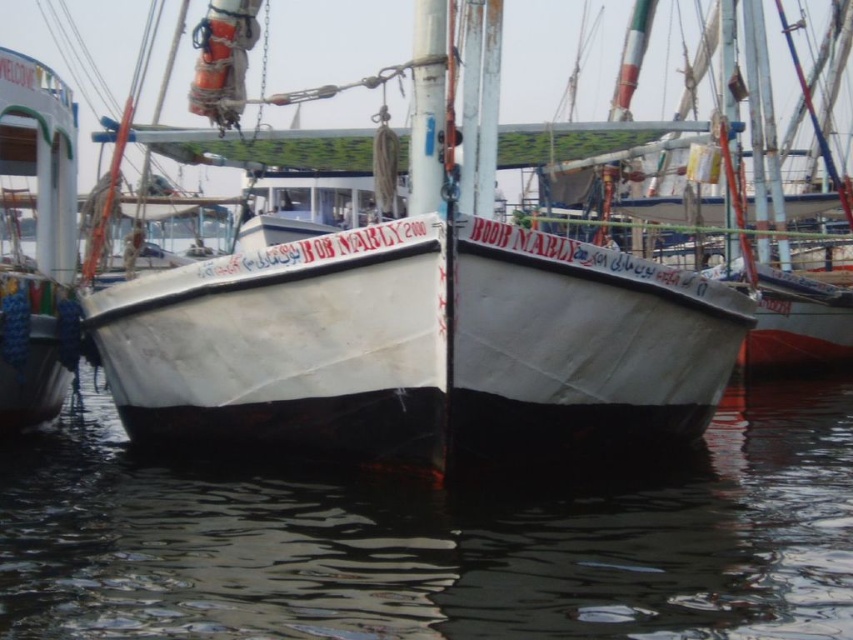
Question: Estimate the real-world distances between objects in this image. Which object is closer to the white matte boat at left?

Choices:
 (A) white matte boat at center
 (B) black rubber water at center

Answer: (A)

Question: Which of the following is the closest to the observer?

Choices:
 (A) black rubber water at center
 (B) white matte boat at left
 (C) white matte boat at center

Answer: (A)

Question: Can you confirm if white matte boat at center is thinner than white matte boat at left?

Choices:
 (A) no
 (B) yes

Answer: (A)

Question: Which object appears closest to the camera in this image?

Choices:
 (A) white matte boat at left
 (B) black rubber water at center
 (C) white matte boat at center

Answer: (B)

Question: Is black rubber water at center below white matte boat at left?

Choices:
 (A) no
 (B) yes

Answer: (B)

Question: Considering the relative positions of black rubber water at center and white matte boat at center in the image provided, where is black rubber water at center located with respect to white matte boat at center?

Choices:
 (A) left
 (B) right

Answer: (A)